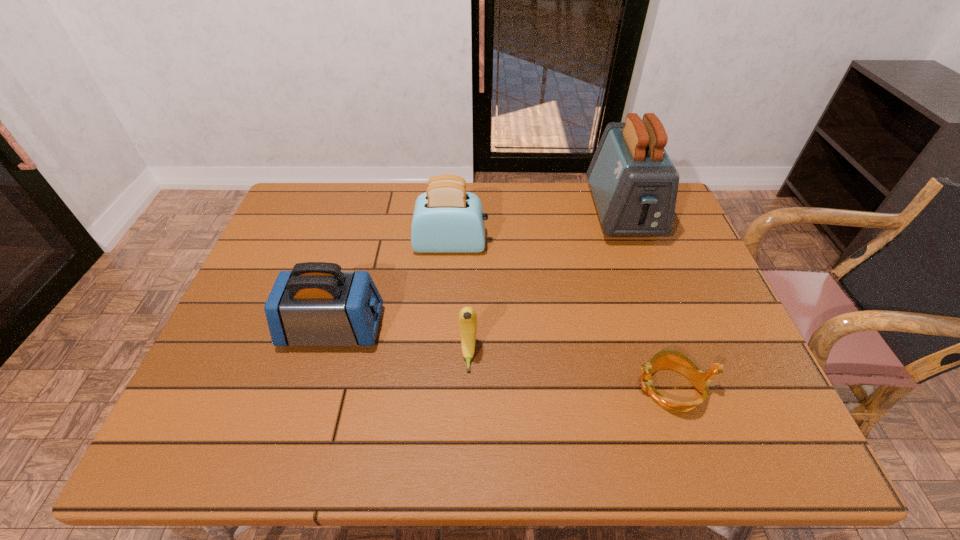
In order to click on the closest toaster relative to the banana in this screenshot , I will do `click(316, 304)`.

In order to click on vacant space that satisfies the following two spatial constraints: 1. on the front-facing side of the tallest object; 2. on the front-facing side of the leftmost toaster in this screenshot , I will do `click(664, 328)`.

Where is `vacant space that satisfies the following two spatial constraints: 1. on the front-facing side of the tallest toaster; 2. on the front-facing side of the leftmost toaster`? vacant space that satisfies the following two spatial constraints: 1. on the front-facing side of the tallest toaster; 2. on the front-facing side of the leftmost toaster is located at coordinates (664, 328).

What are the coordinates of `free space that satisfies the following two spatial constraints: 1. on the front-facing side of the rightmost toaster; 2. at the front emblem of the tiara` in the screenshot? It's located at (685, 388).

Find the location of a particular element. The height and width of the screenshot is (540, 960). vacant space that satisfies the following two spatial constraints: 1. on the front-facing side of the tallest toaster; 2. at the front emblem of the shortest object is located at coordinates (685, 388).

Where is `vacant point that satisfies the following two spatial constraints: 1. on the front-facing side of the tallest object; 2. at the front emblem of the shortest object`? This screenshot has width=960, height=540. vacant point that satisfies the following two spatial constraints: 1. on the front-facing side of the tallest object; 2. at the front emblem of the shortest object is located at coordinates (685, 388).

Where is `free spot that satisfies the following two spatial constraints: 1. on the front-facing side of the tallest toaster; 2. at the front emblem of the shortest object`? This screenshot has width=960, height=540. free spot that satisfies the following two spatial constraints: 1. on the front-facing side of the tallest toaster; 2. at the front emblem of the shortest object is located at coordinates (685, 388).